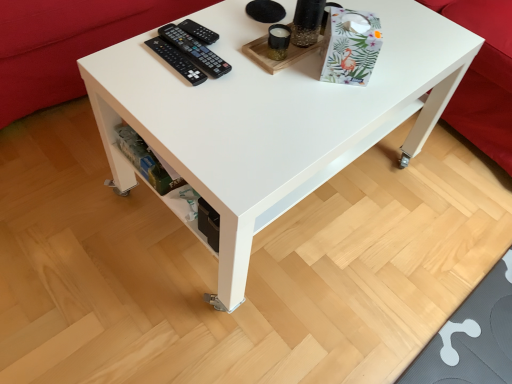
Find the location of a particular element. Image resolution: width=512 pixels, height=384 pixels. free spot behind black plastic remote at upper center, positioned as the 1th control in top-to-bottom order is located at coordinates (222, 14).